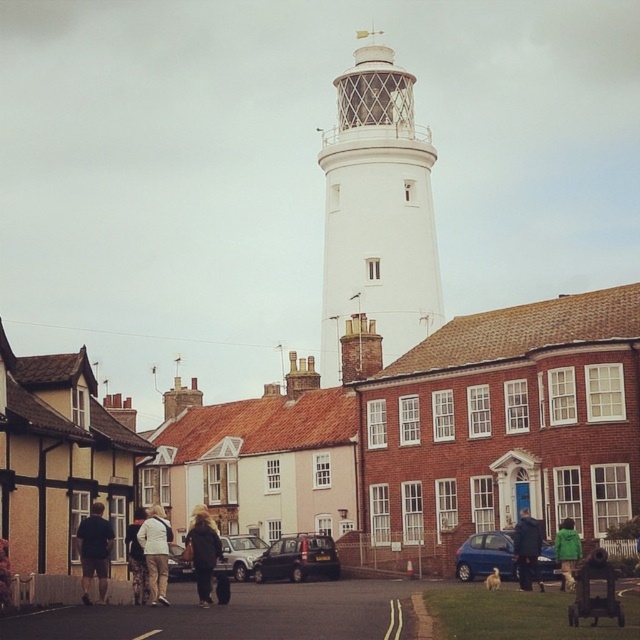
You are standing at the point closest to the lighthouse in the coastal town scene. There are two points marked in the image. One is at coordinates point (344, 109) and the other at point (486, 570). Which point is farther away from you?

Point (344, 109) is behind point (486, 570), so the point farther away from you is point (344, 109).

You are a tourist standing at the entrance of the coastal town and want to take a photo of the white matte lighthouse at center. If you are facing the lighthouse, which direction should you walk to get closer to it?

Since the white matte lighthouse at center is located at point 0.333 on the x axis, you should walk towards the left to get closer to it.

You are a delivery person standing at the edge of the street. You need to place a large package on top of either the dark gray metallic hatchback at center or the dark brown leather jacket at lower center. Which object can the package be placed on without it falling off?

The dark gray metallic hatchback at center has a lesser height compared to the dark brown leather jacket at lower center, so the package should be placed on the dark gray metallic hatchback at center to prevent it from falling off.